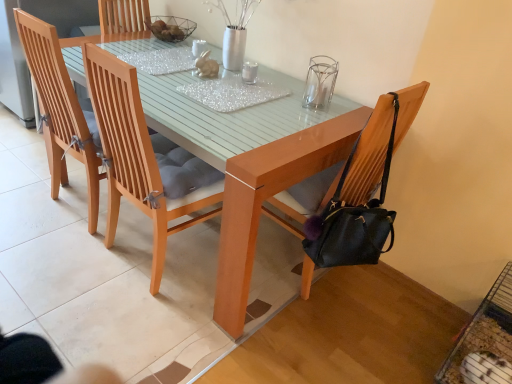
Identify the location of vacant space situated above light brown wooden chair at center, which is counted as the third chair, starting from the left (from a real-world perspective). (211, 76).